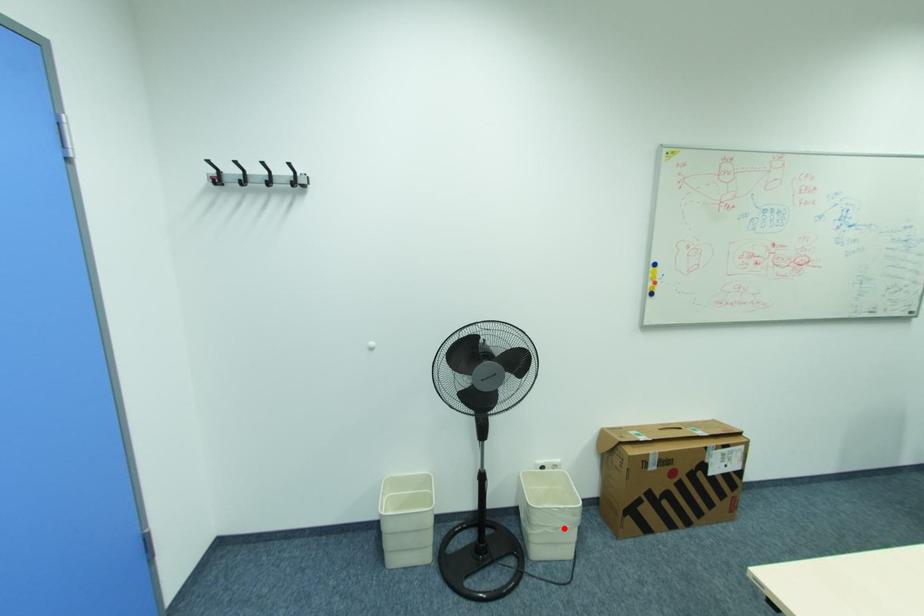
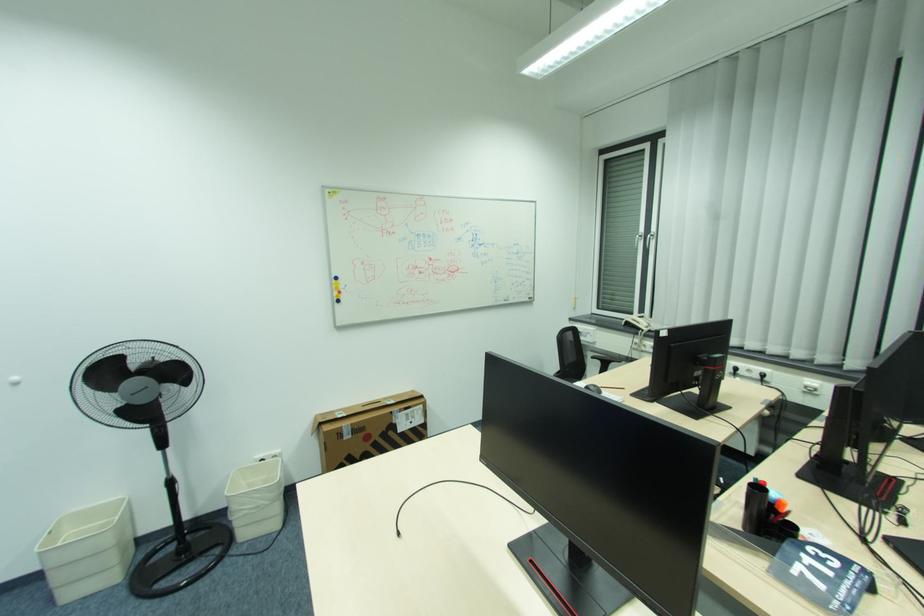
In the second image, find the point that corresponds to the highlighted location in the first image.

(263, 507)